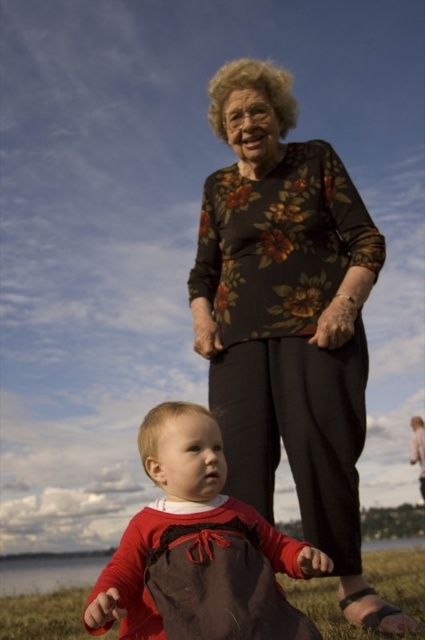
You are a fashion designer observing the scene. You notice the matte red dress at center and the brown textured fabric at lower center. Which one has a smaller size?

The matte red dress at center is smaller than the brown textured fabric at lower center.